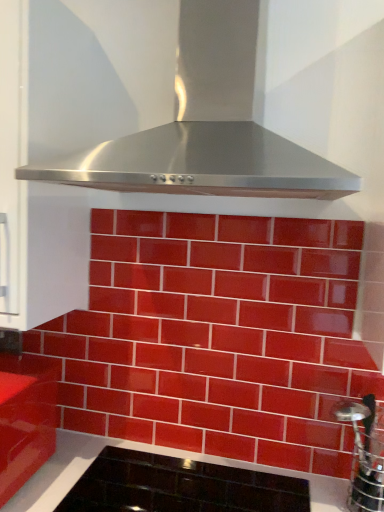
Question: Choose the correct answer: Is black glass cooktop at lower center inside stainless steel range hood at upper center or outside it?

Choices:
 (A) inside
 (B) outside

Answer: (B)

Question: Considering the positions of black glass cooktop at lower center and stainless steel range hood at upper center in the image, is black glass cooktop at lower center wider or thinner than stainless steel range hood at upper center?

Choices:
 (A) thin
 (B) wide

Answer: (A)

Question: Based on their relative distances, which object is nearer to the glossy red cabinet at lower left?

Choices:
 (A) black glass cooktop at lower center
 (B) glossy ceramic tiles at center
 (C) stainless steel range hood at upper center
 (D) stainless steel at right

Answer: (A)

Question: Which is farther from the glossy red cabinet at lower left?

Choices:
 (A) stainless steel at right
 (B) stainless steel range hood at upper center
 (C) black glass cooktop at lower center
 (D) glossy ceramic tiles at center

Answer: (A)